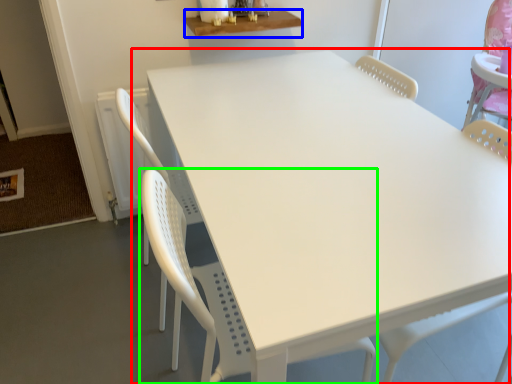
Question: Which is nearer to the table (highlighted by a red box)? table (highlighted by a blue box) or chair (highlighted by a green box).

Choices:
 (A) table
 (B) chair

Answer: (B)